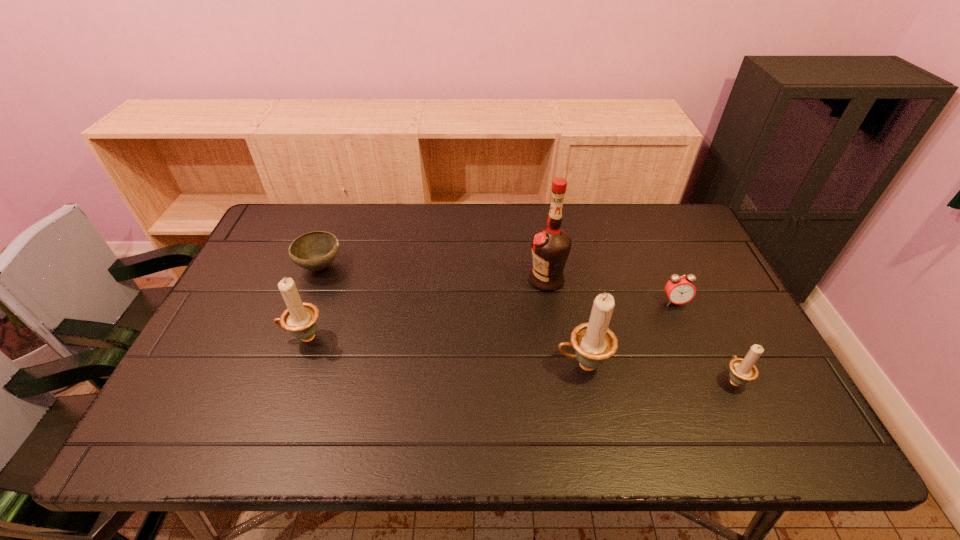
Find the location of a particular element. free space located on the handle side of the leftmost candle_holder is located at coordinates (216, 338).

The image size is (960, 540). What are the coordinates of `free space located 0.350m on the handle side of the second candle_holder from right to left` in the screenshot? It's located at (413, 365).

This screenshot has height=540, width=960. In order to click on vacant region located 0.080m on the handle side of the second candle_holder from right to left in this screenshot , I will do `click(522, 365)`.

The width and height of the screenshot is (960, 540). In order to click on free space located 0.090m on the handle side of the second candle_holder from right to left in this screenshot , I will do `click(518, 365)`.

The height and width of the screenshot is (540, 960). I want to click on vacant area located on the handle side of the shortest candle_holder, so click(x=693, y=295).

This screenshot has height=540, width=960. Find the location of `vacant space located 0.380m on the handle side of the shortest candle_holder`. vacant space located 0.380m on the handle side of the shortest candle_holder is located at coordinates (678, 262).

Where is `vacant area located on the handle side of the shortest candle_holder`? vacant area located on the handle side of the shortest candle_holder is located at coordinates (698, 306).

Locate an element on the screen. vacant space located 0.190m on the front-facing side of the third farthest object is located at coordinates (703, 366).

You are a GUI agent. You are given a task and a screenshot of the screen. Output one action in this format:
    pyautogui.click(x=<x>, y=<y>)
    Task: Click on the vacant space located on the front and back of the liquor
    The image size is (960, 540).
    Given the screenshot: What is the action you would take?
    pyautogui.click(x=433, y=280)

Identify the location of vacant space located 0.350m on the front and back of the liquor. (409, 280).